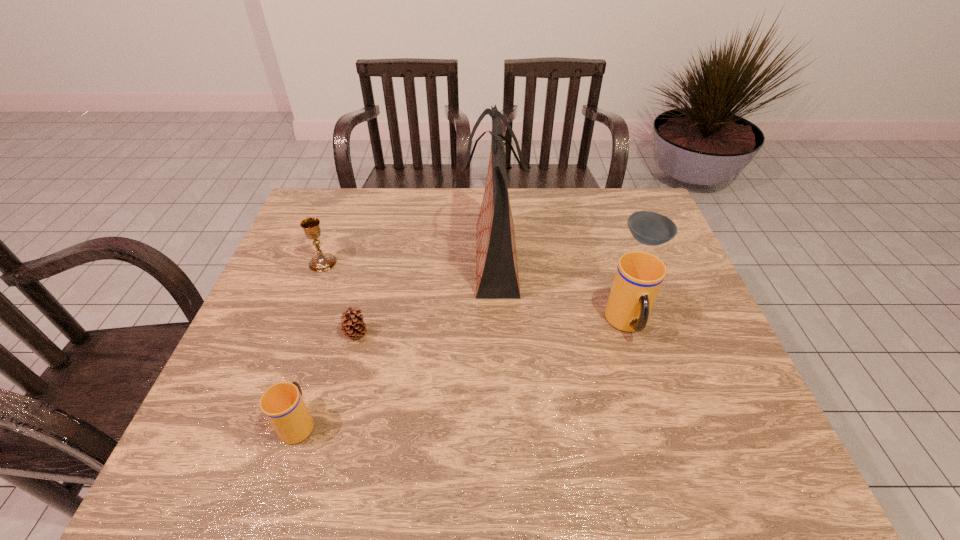
Where is `vacant space positioned on the back of the rightmost object`? This screenshot has height=540, width=960. vacant space positioned on the back of the rightmost object is located at coordinates (626, 190).

The width and height of the screenshot is (960, 540). I want to click on vacant region located 0.050m on the left of the pinecone, so click(324, 334).

I want to click on shopping bag positioned at the far edge, so click(497, 277).

This screenshot has width=960, height=540. What are the coordinates of `bowl located in the far edge section of the desktop` in the screenshot? It's located at (649, 228).

You are a GUI agent. You are given a task and a screenshot of the screen. Output one action in this format:
    pyautogui.click(x=<x>, y=<y>)
    Task: Click on the object positioned at the near edge
    This screenshot has width=960, height=540.
    Given the screenshot: What is the action you would take?
    pyautogui.click(x=283, y=405)

This screenshot has width=960, height=540. I want to click on object that is positioned at the left edge, so click(x=321, y=262).

You are a GUI agent. You are given a task and a screenshot of the screen. Output one action in this format:
    pyautogui.click(x=<x>, y=<y>)
    Task: Click on the cup that is at the right edge
    Image resolution: width=960 pixels, height=540 pixels.
    Given the screenshot: What is the action you would take?
    pyautogui.click(x=639, y=275)

Locate an element on the screen. The height and width of the screenshot is (540, 960). bowl present at the right edge is located at coordinates (649, 228).

Find the location of a particular element. object situated at the far right corner is located at coordinates (649, 228).

In the image, there is a desktop. Identify the location of blank space at the far edge. (520, 193).